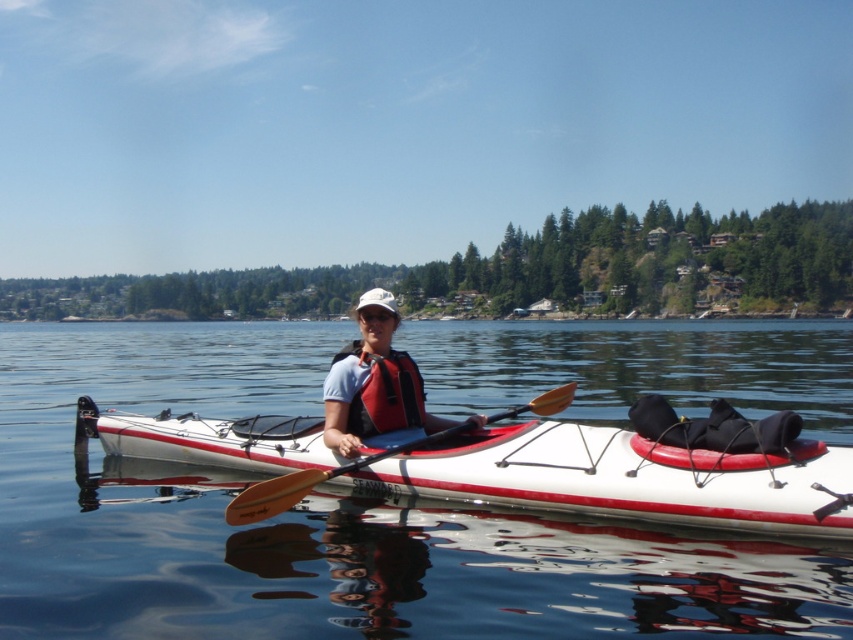
You are planning to store the white glossy kayak at center and the wooden smooth paddle at center in your garage. The garage has a storage rack that can only accommodate items up to the size of the kayak. Can both items fit on the rack?

The white glossy kayak at center is bigger than the wooden smooth paddle at center. Since the storage rack can only accommodate items up to the size of the kayak, the kayak will fit, but the paddle is smaller and should also fit as it is smaller than the kayak.

You are a safety inspector assessing the kayak setup. The transparent water at center and the white matte life vest at center are both visible. Which object is higher in the image?

The transparent water at center is taller than the white matte life vest at center.